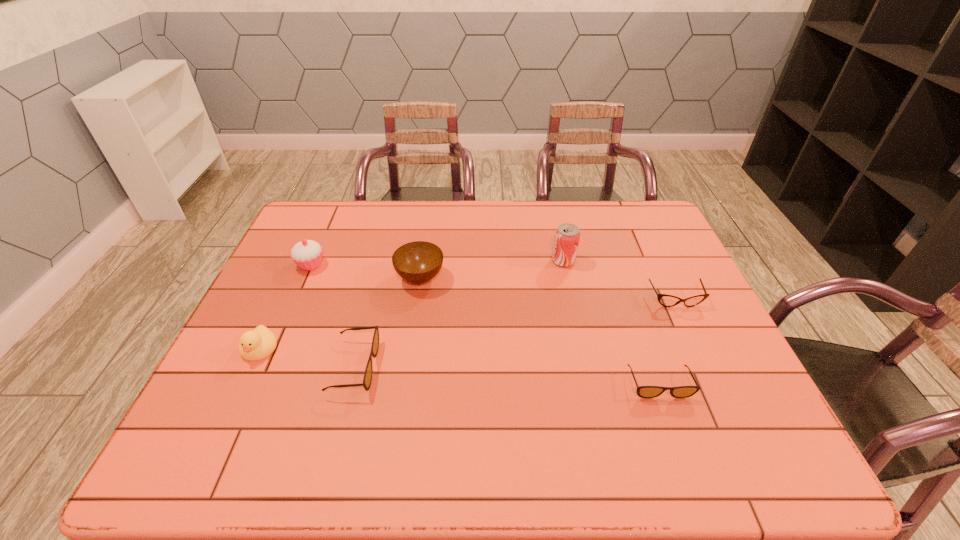
If we want them evenly spaced by inserting an extra sunglasses among them, please locate a free spot for this new sunglasses. Please provide its 2D coordinates. Your answer should be formatted as a tuple, i.e. [(x, y)], where the tuple contains the x and y coordinates of a point satisfying the conditions above.

[(504, 375)]